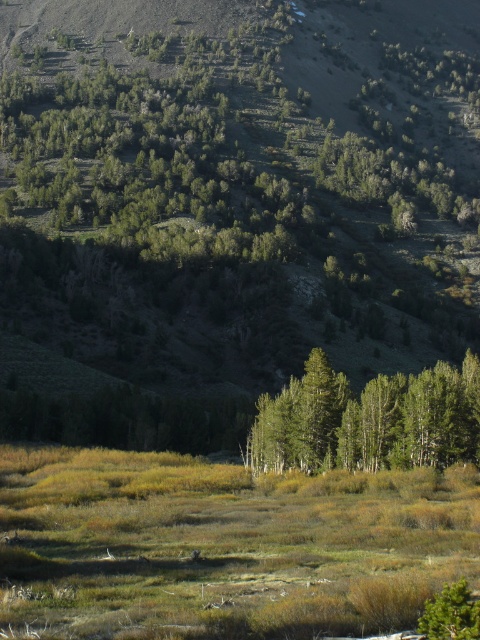
Question: Can you confirm if green matte trees at center is bigger than green matte tree at lower right?

Choices:
 (A) yes
 (B) no

Answer: (A)

Question: Does green matte trees at center appear under green matte tree at lower right?

Choices:
 (A) no
 (B) yes

Answer: (B)

Question: Which object appears farthest from the camera in this image?

Choices:
 (A) green matte trees at center
 (B) green matte tree at lower right

Answer: (A)

Question: Which point is closer to the camera taking this photo?

Choices:
 (A) (300, 435)
 (B) (455, 593)

Answer: (B)

Question: Does green matte trees at center appear over green matte tree at lower right?

Choices:
 (A) yes
 (B) no

Answer: (B)